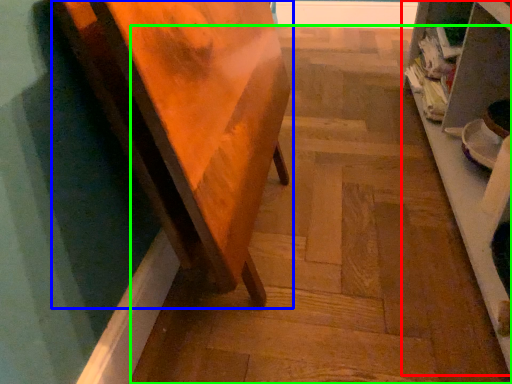
Question: Considering the real-world distances, which object is closest to shelf (highlighted by a red box)? furniture (highlighted by a blue box) or stair (highlighted by a green box).

Choices:
 (A) furniture
 (B) stair

Answer: (B)